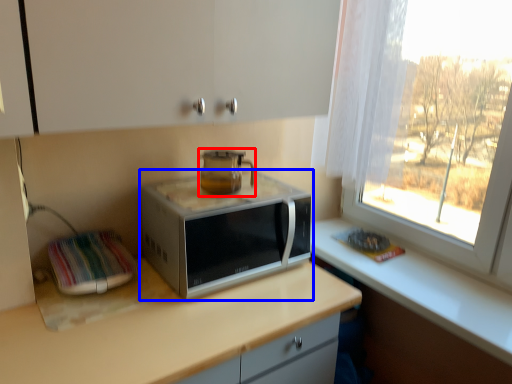
Question: Among these objects, which one is farthest to the camera, home appliance (highlighted by a red box) or microwave oven (highlighted by a blue box)?

Choices:
 (A) home appliance
 (B) microwave oven

Answer: (A)